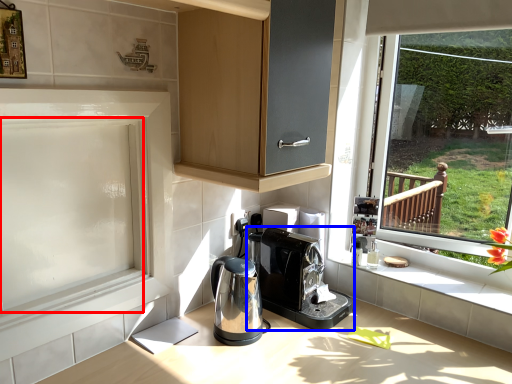
Question: Among these objects, which one is farthest to the camera, screen door (highlighted by a red box) or home appliance (highlighted by a blue box)?

Choices:
 (A) screen door
 (B) home appliance

Answer: (B)